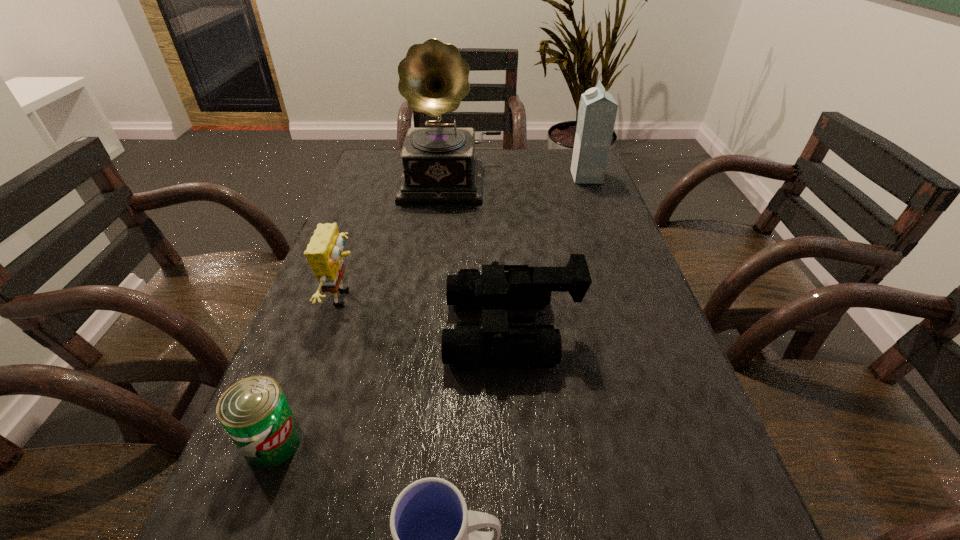
Where is `record player`? The image size is (960, 540). record player is located at coordinates (439, 165).

Locate an element on the screen. This screenshot has height=540, width=960. the fifth shortest object is located at coordinates (597, 112).

Image resolution: width=960 pixels, height=540 pixels. Identify the location of carton. [597, 112].

Locate an element on the screen. The height and width of the screenshot is (540, 960). binoculars is located at coordinates (497, 344).

Where is `sponge`? sponge is located at coordinates (324, 253).

You are a GUI agent. You are given a task and a screenshot of the screen. Output one action in this format:
    pyautogui.click(x=<x>, y=<y>)
    Task: Click on the second nearest object
    The image size is (960, 540).
    Given the screenshot: What is the action you would take?
    pyautogui.click(x=254, y=412)

I want to click on free space located 0.400m on the horn of the tallest object, so click(440, 307).

What are the coordinates of `free location located 0.270m on the front label of the second tallest object` in the screenshot? It's located at (484, 177).

Identify the location of free space located 0.080m on the front label of the second tallest object. (546, 177).

Find the location of a particular element. vacant region located 0.090m on the front label of the second tallest object is located at coordinates (542, 177).